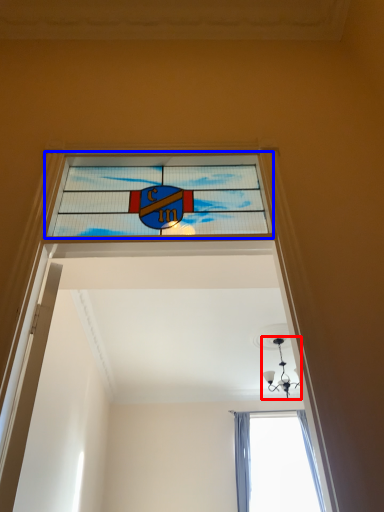
Question: Which object appears farthest to the camera in this image, light fixture (highlighted by a red box) or window (highlighted by a blue box)?

Choices:
 (A) light fixture
 (B) window

Answer: (A)